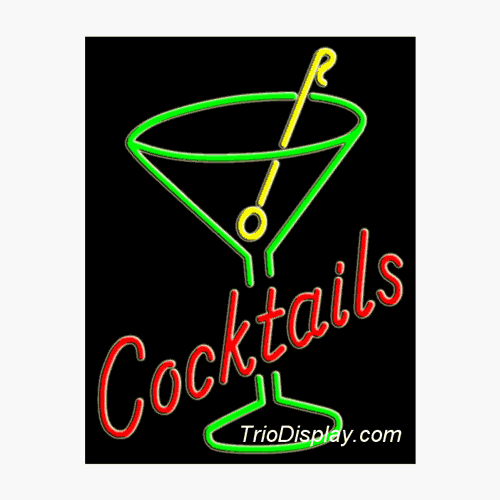
This screenshot has width=500, height=500. What are the coordinates of `glass stem` in the screenshot? It's located at (265, 382).